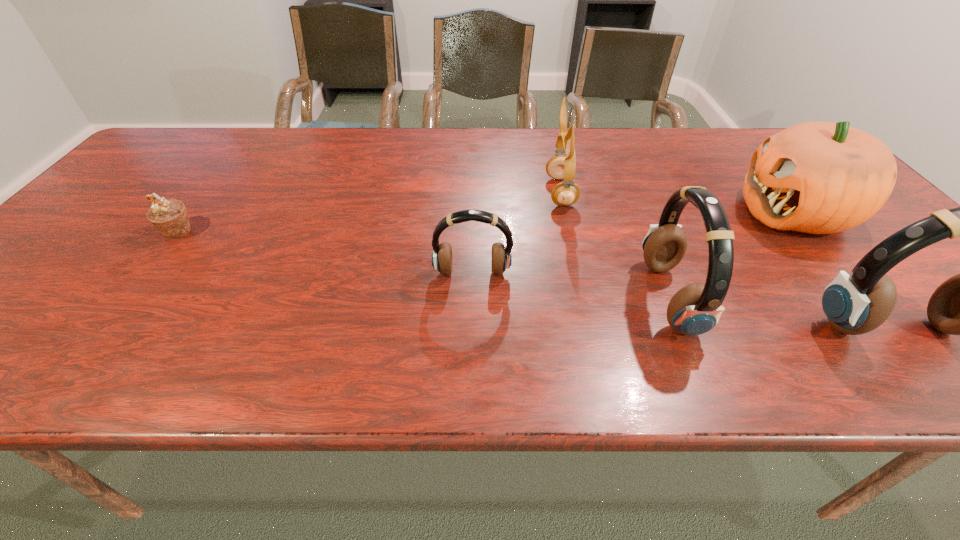
Find the location of `the second shortest object`. the second shortest object is located at coordinates (501, 259).

Where is `the leftmost headset`? the leftmost headset is located at coordinates [x=501, y=259].

You are a GUI agent. You are given a task and a screenshot of the screen. Output one action in this format:
    pyautogui.click(x=<x>, y=<y>)
    Task: Click on the fourth object from left to right
    Image resolution: width=960 pixels, height=540 pixels.
    Given the screenshot: What is the action you would take?
    pyautogui.click(x=695, y=309)

Where is `the second headset from left to right`? the second headset from left to right is located at coordinates (695, 309).

Image resolution: width=960 pixels, height=540 pixels. I want to click on the third object from left to right, so click(x=566, y=193).

I want to click on pumpkin, so click(x=817, y=177).

Where is `the leftmost object`? the leftmost object is located at coordinates (169, 216).

Image resolution: width=960 pixels, height=540 pixels. In order to click on muffin in this screenshot , I will do `click(169, 216)`.

Identify the location of vacant space located 0.050m on the ear cup of the second object from left to right. Image resolution: width=960 pixels, height=540 pixels. (472, 299).

Where is `free location located on the ear cup of the second shortest headset`? This screenshot has height=540, width=960. free location located on the ear cup of the second shortest headset is located at coordinates (610, 299).